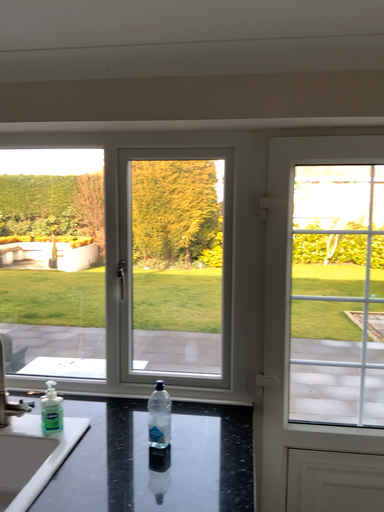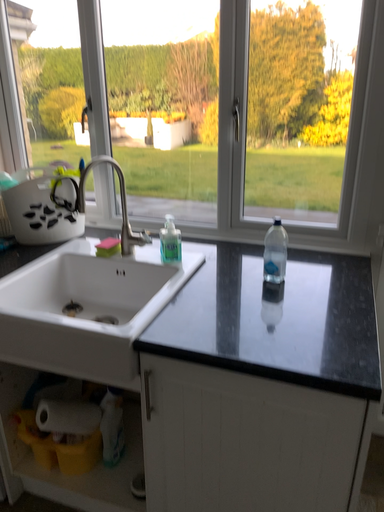
Question: How did the camera likely rotate when shooting the video?

Choices:
 (A) rotated downward
 (B) rotated upward

Answer: (A)